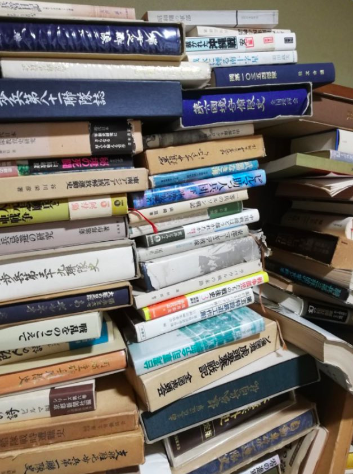
At what (x,y) coordinates should I click in order to perform the action: click on thin tan book left upper corner. Please return your answer as a coordinate pair (x, y). Looking at the image, I should click on (49, 10).